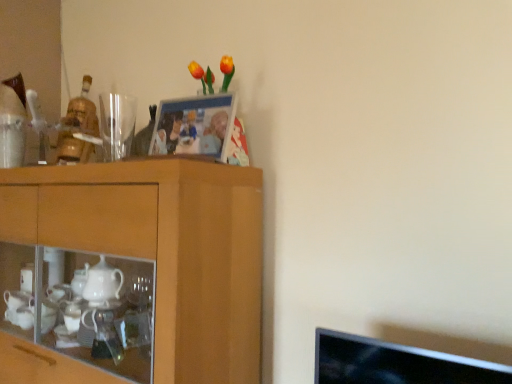
Question: Does transparent glass at upper left lie in front of wooden photo frame at upper center?

Choices:
 (A) yes
 (B) no

Answer: (B)

Question: From a real-world perspective, is transparent glass at upper left positioned under wooden photo frame at upper center based on gravity?

Choices:
 (A) no
 (B) yes

Answer: (A)

Question: Does transparent glass at upper left come behind wooden photo frame at upper center?

Choices:
 (A) no
 (B) yes

Answer: (B)

Question: Is transparent glass at upper left oriented away from wooden photo frame at upper center?

Choices:
 (A) yes
 (B) no

Answer: (B)

Question: Considering the relative sizes of transparent glass at upper left and wooden photo frame at upper center in the image provided, is transparent glass at upper left bigger than wooden photo frame at upper center?

Choices:
 (A) yes
 (B) no

Answer: (B)

Question: Is wooden photo frame at upper center surrounded by transparent glass at upper left?

Choices:
 (A) no
 (B) yes

Answer: (A)

Question: Does wooden cabinet at left appear on the right side of wooden photo frame at upper center?

Choices:
 (A) yes
 (B) no

Answer: (B)

Question: Can you confirm if wooden cabinet at left is smaller than wooden photo frame at upper center?

Choices:
 (A) no
 (B) yes

Answer: (A)

Question: Is wooden cabinet at left at the left side of wooden photo frame at upper center?

Choices:
 (A) yes
 (B) no

Answer: (A)

Question: Is wooden cabinet at left turned away from wooden photo frame at upper center?

Choices:
 (A) yes
 (B) no

Answer: (B)

Question: Can you confirm if wooden cabinet at left is shorter than wooden photo frame at upper center?

Choices:
 (A) yes
 (B) no

Answer: (B)

Question: Are wooden cabinet at left and wooden photo frame at upper center located far from each other?

Choices:
 (A) no
 (B) yes

Answer: (A)

Question: Are transparent glass at upper left and wooden cabinet at left far apart?

Choices:
 (A) no
 (B) yes

Answer: (A)